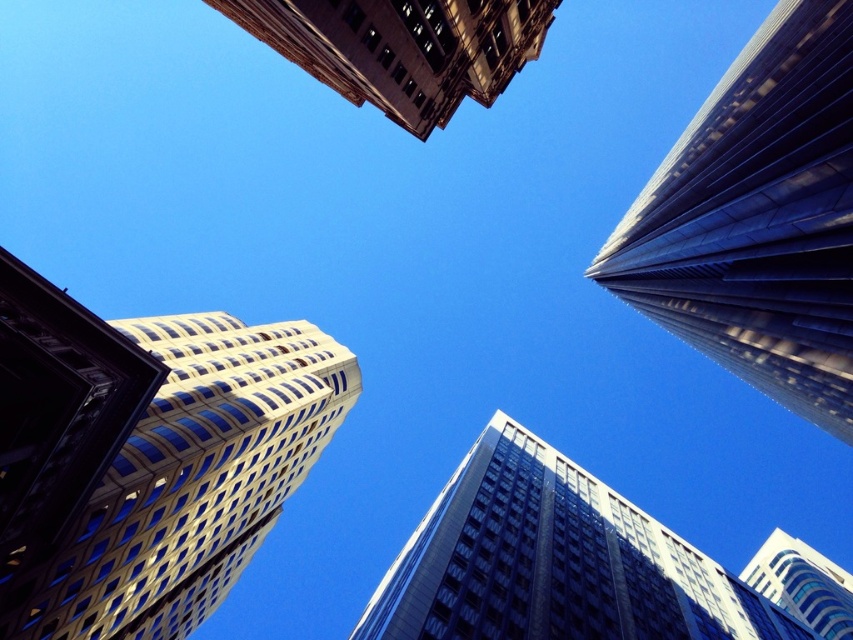
Question: Which object appears closest to the camera in this image?

Choices:
 (A) gold glass skyscraper at center
 (B) white glass building at upper right

Answer: (A)

Question: Among these objects, which one is farthest from the camera?

Choices:
 (A) matte glass skyscraper at center
 (B) glassy reflective skyscraper at center
 (C) glassy steel skyscraper at upper right
 (D) brown stone building at upper center

Answer: (B)

Question: Can you confirm if gold glass skyscraper at center is positioned below glassy reflective skyscraper at center?

Choices:
 (A) no
 (B) yes

Answer: (A)

Question: Is glassy steel skyscraper at upper right above brown stone building at upper center?

Choices:
 (A) no
 (B) yes

Answer: (A)

Question: Which point is farther to the camera?

Choices:
 (A) gold glass skyscraper at center
 (B) brown stone building at upper center
 (C) glassy reflective skyscraper at center

Answer: (C)

Question: Does gold glass skyscraper at center appear on the right side of matte glass skyscraper at center?

Choices:
 (A) yes
 (B) no

Answer: (B)